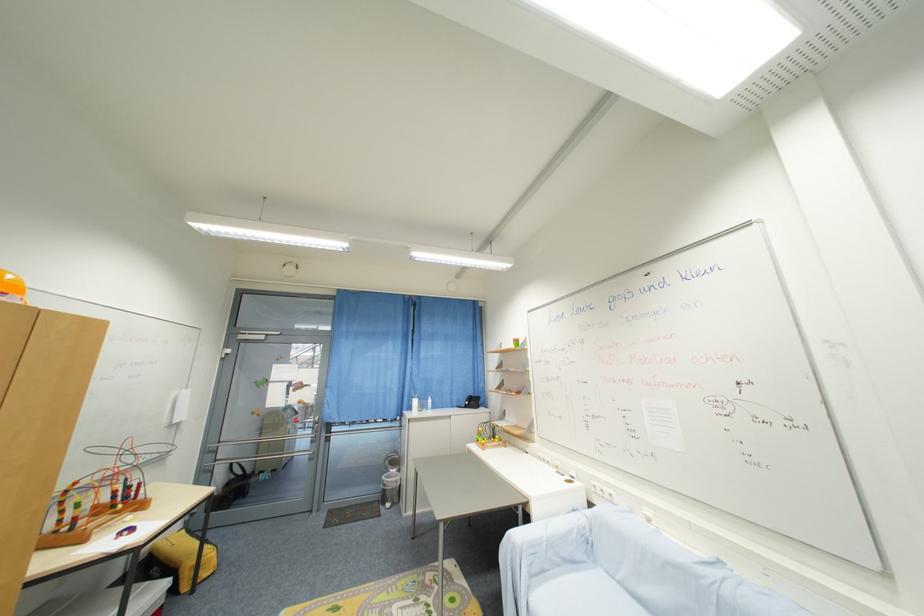
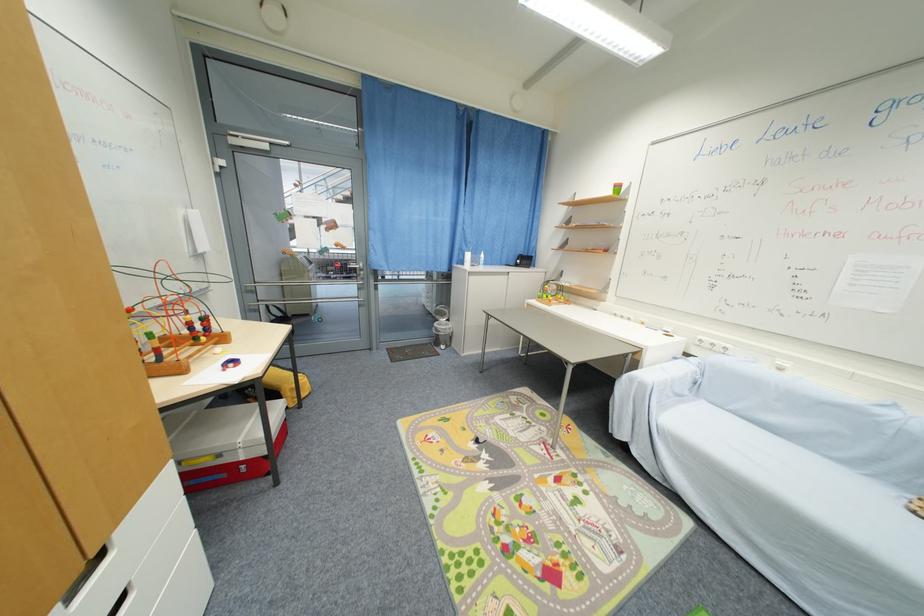
Locate, in the second image, the point that corresponds to the point at 118,508 in the first image.

(201, 341)